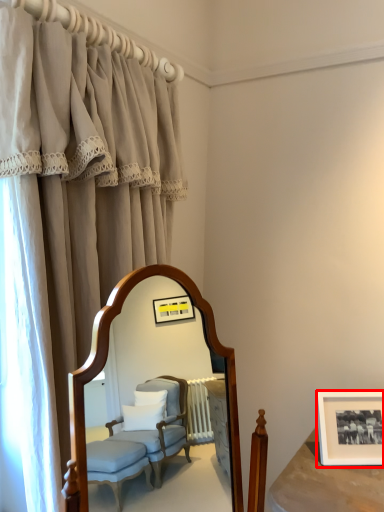
Question: From the image's perspective, what is the correct spatial positioning of picture frame (annotated by the red box) in reference to curtain?

Choices:
 (A) below
 (B) above

Answer: (A)